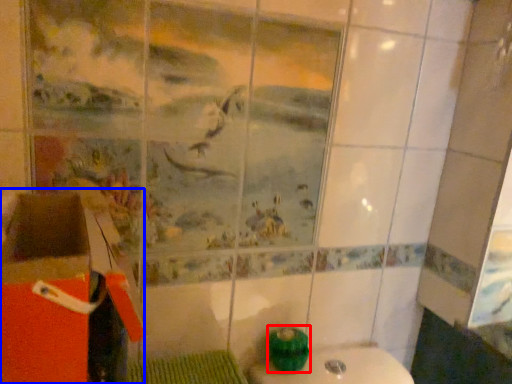
Question: Which of the following is the closest to the observer, teal (highlighted by a red box) or cardboard box (highlighted by a blue box)?

Choices:
 (A) teal
 (B) cardboard box

Answer: (B)